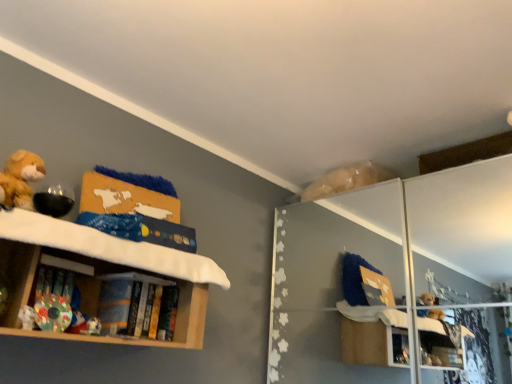
Question: In terms of size, does wooden bookshelf at left appear bigger or smaller than transparent glass door at upper right?

Choices:
 (A) small
 (B) big

Answer: (A)

Question: In the image, is wooden bookshelf at left positioned in front of or behind transparent glass door at upper right?

Choices:
 (A) front
 (B) behind

Answer: (A)

Question: Estimate the real-world distances between objects in this image. Which object is farther from the transparent glass door at upper right?

Choices:
 (A) white plush toy at lower left
 (B) multicolored fabric book at lower left, marked as the first book in a front-to-back arrangement
 (C) hardcover book at center, arranged as the 2th book when viewed from the left
 (D) wooden bookshelf at left

Answer: (A)

Question: Estimate the real-world distances between objects in this image. Which object is closer to the hardcover book at center, which is the 1th book in back-to-front order?

Choices:
 (A) multicolored fabric book at lower left, placed as the 2th book when sorted from back to front
 (B) wooden bookshelf at left
 (C) white plush toy at lower left
 (D) transparent glass door at upper right

Answer: (B)